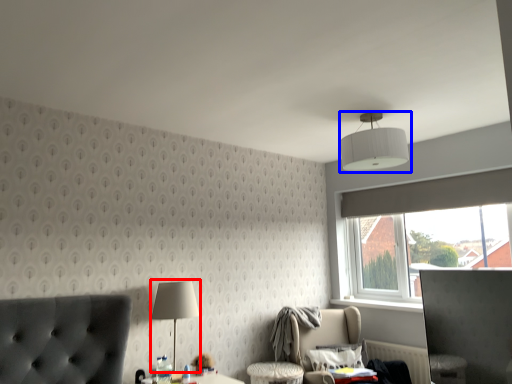
Question: Which of the following is the closest to the observer, table lamp (highlighted by a red box) or lamp (highlighted by a blue box)?

Choices:
 (A) table lamp
 (B) lamp

Answer: (B)